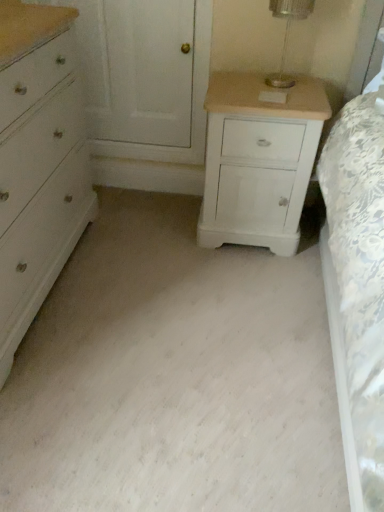
Question: Should I look upward or downward to see white painted wood nightstand at right?

Choices:
 (A) down
 (B) up

Answer: (B)

Question: Would you say clear glass table lamp at upper center contains white painted wood nightstand at right?

Choices:
 (A) yes
 (B) no

Answer: (B)

Question: From a real-world perspective, is clear glass table lamp at upper center located beneath white painted wood nightstand at right?

Choices:
 (A) yes
 (B) no

Answer: (B)

Question: Can you confirm if clear glass table lamp at upper center is taller than white painted wood nightstand at right?

Choices:
 (A) no
 (B) yes

Answer: (A)

Question: Is clear glass table lamp at upper center shorter than white painted wood nightstand at right?

Choices:
 (A) yes
 (B) no

Answer: (A)

Question: Is clear glass table lamp at upper center closer to the viewer compared to white painted wood nightstand at right?

Choices:
 (A) yes
 (B) no

Answer: (A)

Question: Is clear glass table lamp at upper center not within white painted wood nightstand at right?

Choices:
 (A) yes
 (B) no

Answer: (A)

Question: Can you see white painted wood nightstand at right touching clear glass table lamp at upper center?

Choices:
 (A) yes
 (B) no

Answer: (B)

Question: Is the position of white painted wood nightstand at right more distant than that of clear glass table lamp at upper center?

Choices:
 (A) yes
 (B) no

Answer: (A)

Question: Can you confirm if white painted wood nightstand at right is wider than clear glass table lamp at upper center?

Choices:
 (A) yes
 (B) no

Answer: (A)

Question: Considering the relative positions of white painted wood nightstand at right and clear glass table lamp at upper center in the image provided, is white painted wood nightstand at right to the left of clear glass table lamp at upper center from the viewer's perspective?

Choices:
 (A) yes
 (B) no

Answer: (A)

Question: Can you confirm if white painted wood nightstand at right is smaller than clear glass table lamp at upper center?

Choices:
 (A) no
 (B) yes

Answer: (A)

Question: Can you confirm if white painted wood nightstand at right is taller than clear glass table lamp at upper center?

Choices:
 (A) yes
 (B) no

Answer: (A)

Question: Is white painted wood chest of drawers at left located within clear glass table lamp at upper center?

Choices:
 (A) yes
 (B) no

Answer: (B)